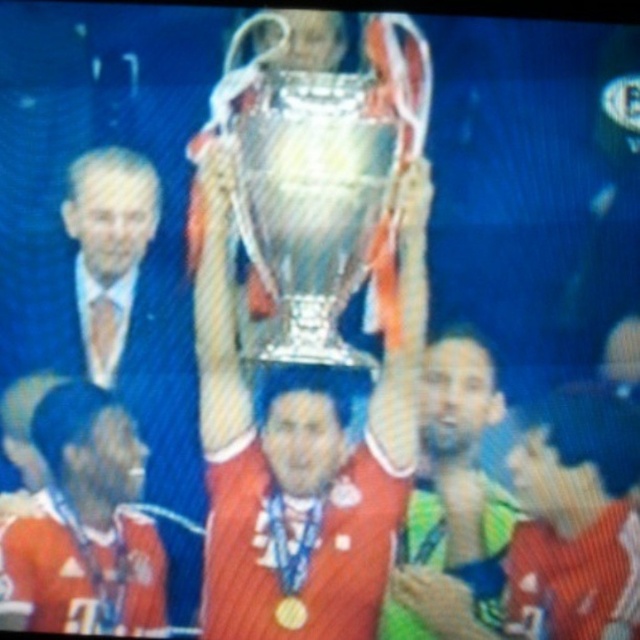
Question: Estimate the real-world distances between objects in this image. Which object is closer to the shiny green jersey at center?

Choices:
 (A) blue fabric head at center
 (B) matte gold trophy at center

Answer: (A)

Question: Can you confirm if smooth skin head at center is positioned above matte gold trophy at center?

Choices:
 (A) yes
 (B) no

Answer: (B)

Question: Is metallic trophy at center smaller than matte gold head at center?

Choices:
 (A) yes
 (B) no

Answer: (B)

Question: Which of these objects is positioned farthest from the white hair at left?

Choices:
 (A) shiny green jersey at center
 (B) smooth skin head at center

Answer: (A)

Question: Which is nearer to the shiny green jersey at center?

Choices:
 (A) white hair at left
 (B) matte red jersey at center
 (C) smooth blue jersey at center

Answer: (C)

Question: Does metallic trophy at center have a greater width compared to matte gold head at center?

Choices:
 (A) yes
 (B) no

Answer: (A)